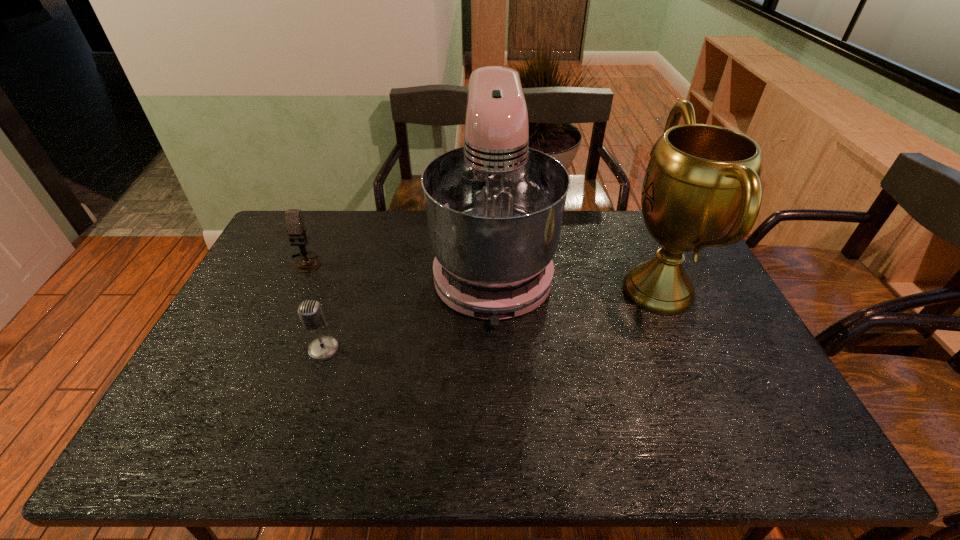
Where is `blank space located on the front-facing side of the farther microphone`? This screenshot has width=960, height=540. blank space located on the front-facing side of the farther microphone is located at coordinates click(x=288, y=301).

I want to click on vacant region located on the left of the shorter microphone, so click(287, 349).

Find the location of a particular element. The height and width of the screenshot is (540, 960). mixer that is at the far edge is located at coordinates (494, 208).

Where is `trophy cup that is at the far edge`? trophy cup that is at the far edge is located at coordinates (702, 188).

You are a GUI agent. You are given a task and a screenshot of the screen. Output one action in this format:
    pyautogui.click(x=<x>, y=<y>)
    Task: Click on the object that is positioned at the left edge
    The width and height of the screenshot is (960, 540).
    Given the screenshot: What is the action you would take?
    pyautogui.click(x=296, y=230)

Locate an element on the screen. This screenshot has width=960, height=540. object that is positioned at the right edge is located at coordinates (702, 188).

The image size is (960, 540). I want to click on object located at the far right corner, so click(702, 188).

At what (x,y) coordinates should I click in order to perform the action: click on vacant space at the far edge of the desktop. Please return your answer as a coordinate pair (x, y). This screenshot has width=960, height=540. Looking at the image, I should click on (394, 217).

Image resolution: width=960 pixels, height=540 pixels. In order to click on vacant area at the near edge in this screenshot , I will do `click(734, 450)`.

Image resolution: width=960 pixels, height=540 pixels. I want to click on free spot at the left edge of the desktop, so click(x=263, y=252).